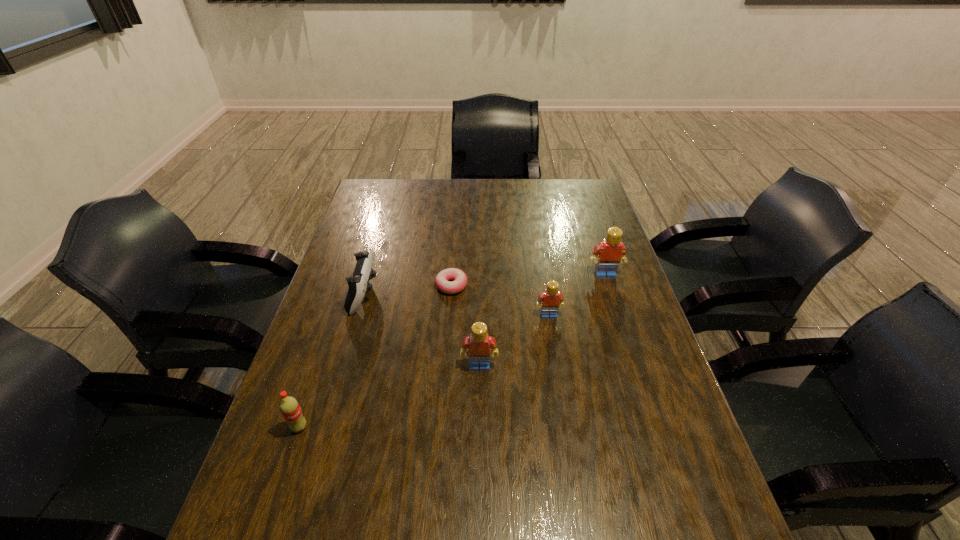
All Legos are currently evenly spaced. To continue this pattern, where would you add another Lego on the left? Please point out a vacant spot. Please provide its 2D coordinates. Your answer should be formatted as a tuple, i.e. [(x, y)], where the tuple contains the x and y coordinates of a point satisfying the conditions above.

[(391, 430)]